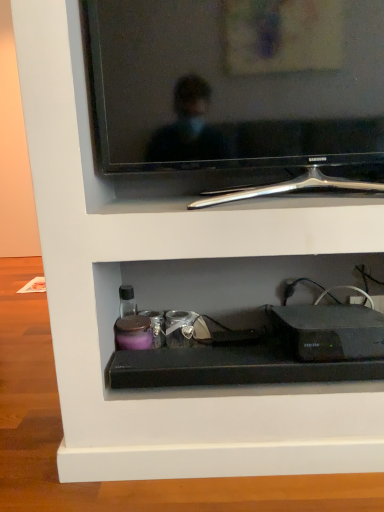
Question: Would you say black plastic router at lower center is inside or outside black glossy tv at upper center?

Choices:
 (A) outside
 (B) inside

Answer: (A)

Question: Considering the positions of black plastic router at lower center and black glossy tv at upper center in the image, is black plastic router at lower center wider or thinner than black glossy tv at upper center?

Choices:
 (A) thin
 (B) wide

Answer: (B)

Question: Is point (340, 317) closer or farther from the camera than point (127, 170)?

Choices:
 (A) farther
 (B) closer

Answer: (A)

Question: Is black glossy tv at upper center wider or thinner than black plastic router at lower center?

Choices:
 (A) thin
 (B) wide

Answer: (A)

Question: In terms of size, does black glossy tv at upper center appear bigger or smaller than black plastic router at lower center?

Choices:
 (A) small
 (B) big

Answer: (B)

Question: Is point (372, 58) closer or farther from the camera than point (301, 337)?

Choices:
 (A) farther
 (B) closer

Answer: (B)

Question: Is black glossy tv at upper center taller or shorter than black plastic router at lower center?

Choices:
 (A) short
 (B) tall

Answer: (B)